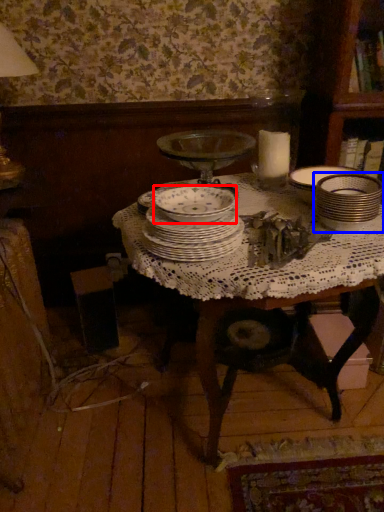
Question: Which object appears closest to the camera in this image, bowl (highlighted by a red box) or tableware (highlighted by a blue box)?

Choices:
 (A) bowl
 (B) tableware

Answer: (A)